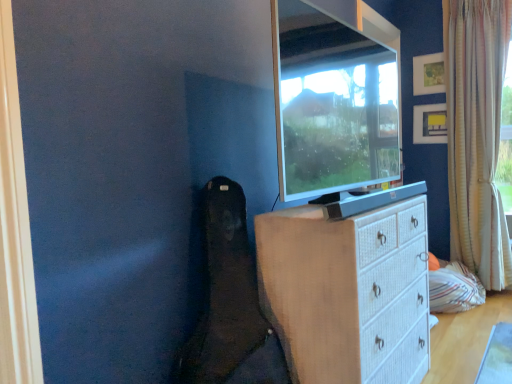
Question: Does matte black tv at upper center appear on the left side of matte yellow picture frame at upper right, the first picture frame in the bottom-to-top sequence?

Choices:
 (A) yes
 (B) no

Answer: (A)

Question: Can you confirm if matte black tv at upper center is smaller than matte yellow picture frame at upper right, which appears as the 2th picture frame when viewed from the top?

Choices:
 (A) no
 (B) yes

Answer: (A)

Question: Can you confirm if matte black tv at upper center is bigger than matte yellow picture frame at upper right, the first picture frame in the bottom-to-top sequence?

Choices:
 (A) yes
 (B) no

Answer: (A)

Question: Is matte black tv at upper center closer to the viewer compared to matte yellow picture frame at upper right, the first picture frame in the bottom-to-top sequence?

Choices:
 (A) yes
 (B) no

Answer: (A)

Question: Considering the relative positions of matte black tv at upper center and matte yellow picture frame at upper right, which appears as the 2th picture frame when viewed from the top, in the image provided, is matte black tv at upper center behind matte yellow picture frame at upper right, which appears as the 2th picture frame when viewed from the top,?

Choices:
 (A) yes
 (B) no

Answer: (B)

Question: From the image's perspective, is matte black tv at upper center located above or below matte yellow picture frame at upper right, the first picture frame in the bottom-to-top sequence?

Choices:
 (A) above
 (B) below

Answer: (B)

Question: Considering the positions of matte black tv at upper center and matte yellow picture frame at upper right, the first picture frame in the bottom-to-top sequence, in the image, is matte black tv at upper center bigger or smaller than matte yellow picture frame at upper right, the first picture frame in the bottom-to-top sequence,?

Choices:
 (A) small
 (B) big

Answer: (B)

Question: Is matte black tv at upper center wider or thinner than matte yellow picture frame at upper right, the first picture frame in the bottom-to-top sequence?

Choices:
 (A) thin
 (B) wide

Answer: (B)

Question: Is matte black tv at upper center situated inside matte yellow picture frame at upper right, the first picture frame in the bottom-to-top sequence, or outside?

Choices:
 (A) inside
 (B) outside

Answer: (B)

Question: From the image's perspective, relative to matte white picture frame at upper right, acting as the 2th picture frame starting from the bottom, is white wicker chest of drawers at center above or below?

Choices:
 (A) above
 (B) below

Answer: (B)

Question: Is white wicker chest of drawers at center spatially inside matte white picture frame at upper right, acting as the 2th picture frame starting from the bottom, or outside of it?

Choices:
 (A) outside
 (B) inside

Answer: (A)

Question: Is white wicker chest of drawers at center wider or thinner than matte white picture frame at upper right, positioned as the first picture frame in top-to-bottom order?

Choices:
 (A) wide
 (B) thin

Answer: (A)

Question: Considering the relative positions of white wicker chest of drawers at center and matte white picture frame at upper right, acting as the 2th picture frame starting from the bottom, in the image provided, is white wicker chest of drawers at center to the left or to the right of matte white picture frame at upper right, acting as the 2th picture frame starting from the bottom,?

Choices:
 (A) right
 (B) left

Answer: (B)

Question: From a real-world perspective, is matte white picture frame at upper right, positioned as the first picture frame in top-to-bottom order, positioned above or below white textured curtain at right?

Choices:
 (A) above
 (B) below

Answer: (A)

Question: Visually, is matte white picture frame at upper right, positioned as the first picture frame in top-to-bottom order, positioned to the left or to the right of white textured curtain at right?

Choices:
 (A) right
 (B) left

Answer: (B)